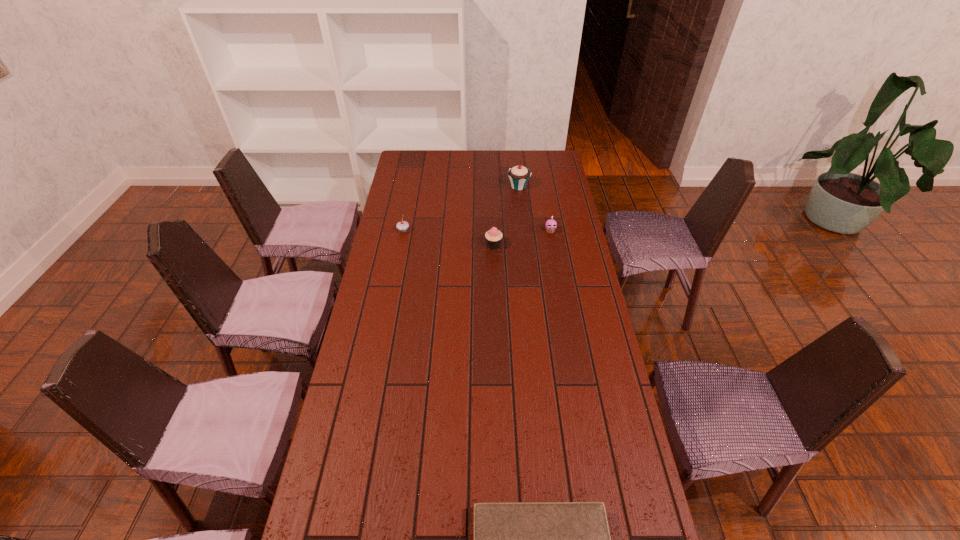
At what (x,y) coordinates should I click in order to perform the action: click on the farthest object. Please return your answer as a coordinate pair (x, y). Looking at the image, I should click on (519, 175).

Where is `the tallest object`? The height and width of the screenshot is (540, 960). the tallest object is located at coordinates (519, 175).

Identify the location of the second nearest object. (493, 237).

This screenshot has width=960, height=540. Identify the location of the nearest cupcake. (493, 237).

What are the coordinates of `the leftmost cupcake` in the screenshot? It's located at (403, 225).

This screenshot has height=540, width=960. What are the coordinates of `the rightmost cupcake` in the screenshot? It's located at (551, 224).

You are a GUI agent. You are given a task and a screenshot of the screen. Output one action in this format:
    pyautogui.click(x=<x>, y=<y>)
    Task: Click on the free location located on the left of the tallest cupcake
    The image size is (960, 540).
    Given the screenshot: What is the action you would take?
    pyautogui.click(x=461, y=187)

At what (x,y) coordinates should I click in order to perform the action: click on vacant space situated 0.290m on the back of the nearest cupcake. Please return your answer as a coordinate pair (x, y). The image size is (960, 540). Looking at the image, I should click on (492, 199).

Find the location of a particular element. The image size is (960, 540). free location located on the front of the leftmost cupcake is located at coordinates (401, 244).

This screenshot has height=540, width=960. Identify the location of free spot located on the face of the rightmost cupcake. (564, 302).